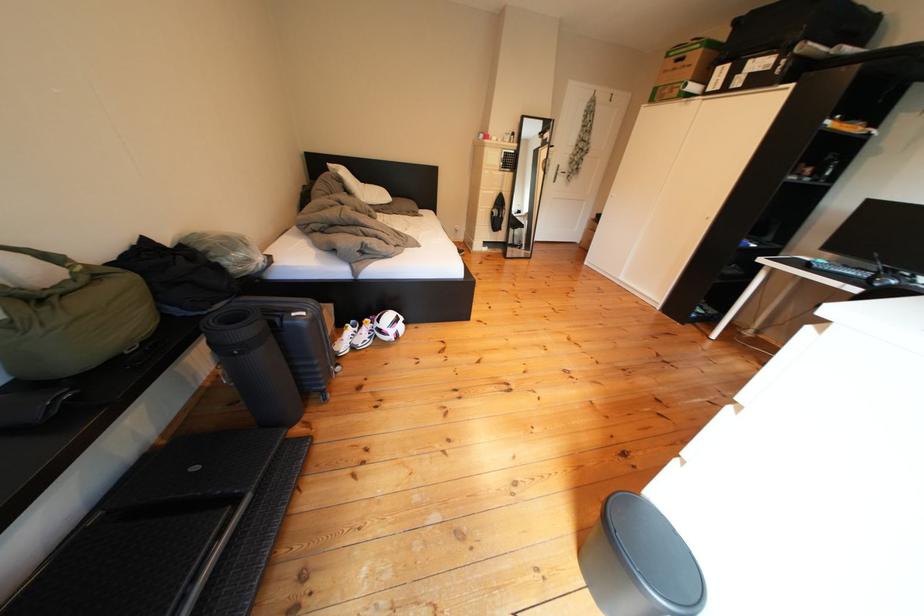
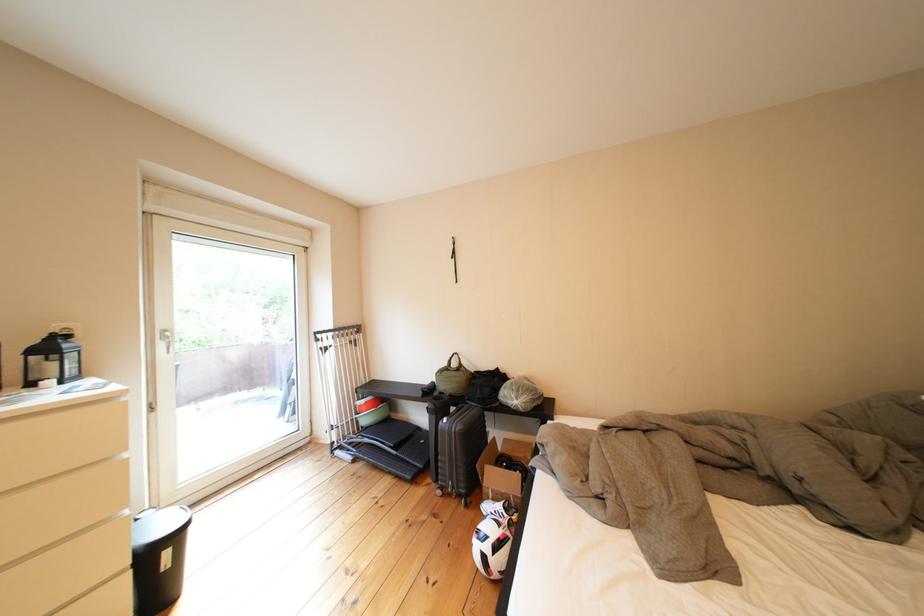
Find the pixel in the second image that matches pixel 418 328 in the first image.

(499, 562)